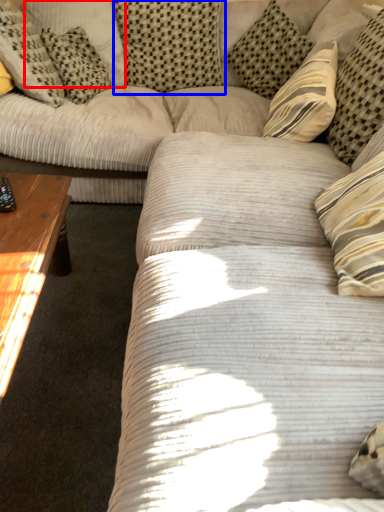
Question: Which object is closer to the camera taking this photo, pillow (highlighted by a red box) or pillow (highlighted by a blue box)?

Choices:
 (A) pillow
 (B) pillow

Answer: (B)